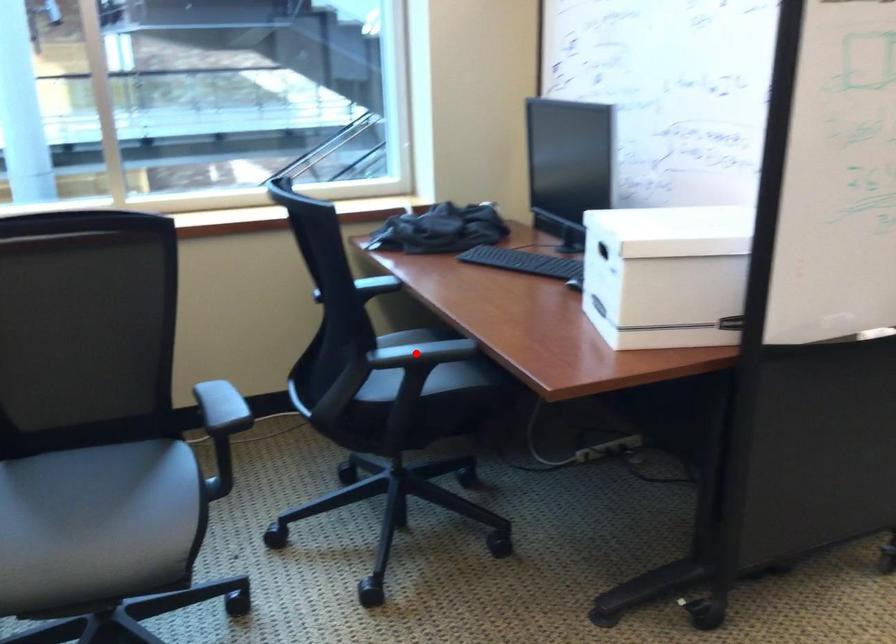
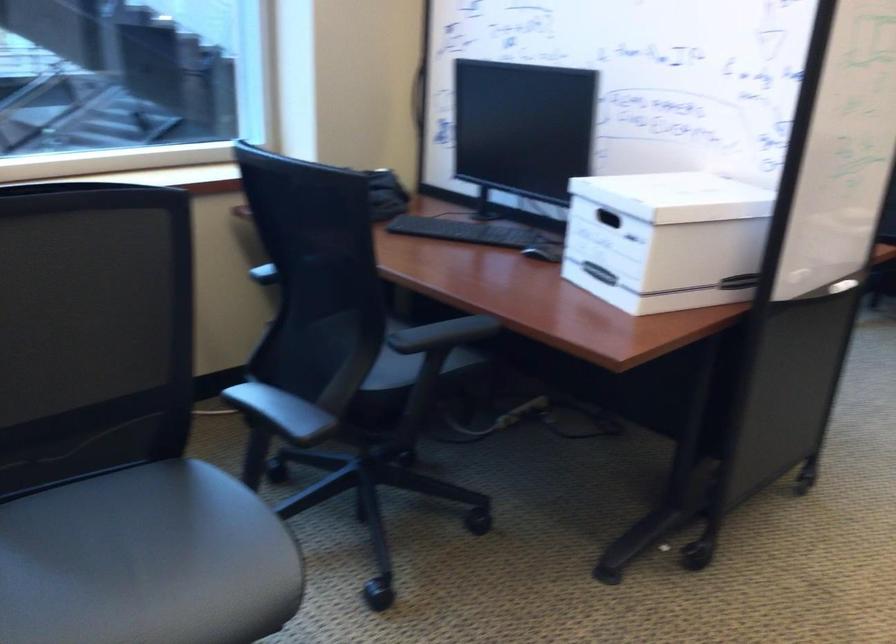
Where in the second image is the point corresponding to the highlighted location from the first image?

(442, 334)